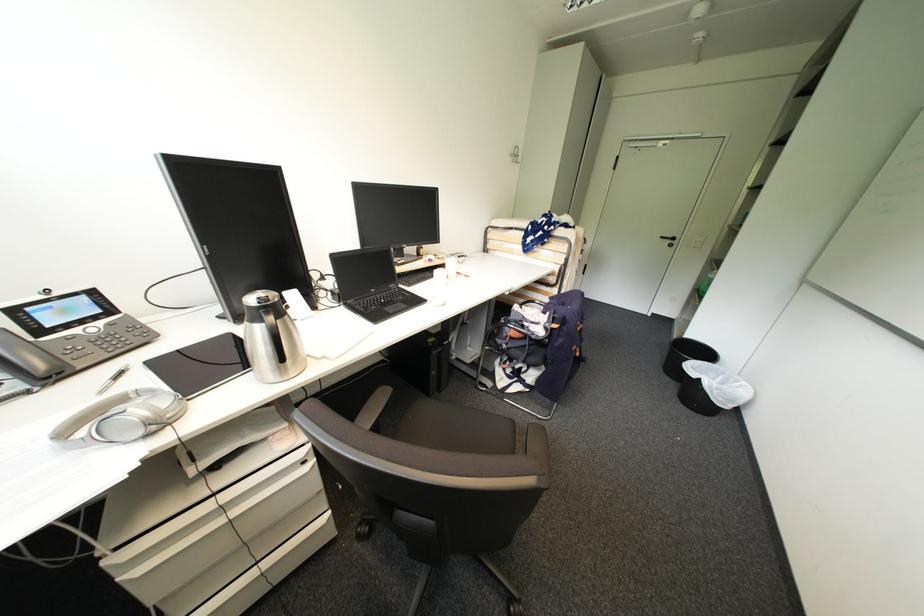
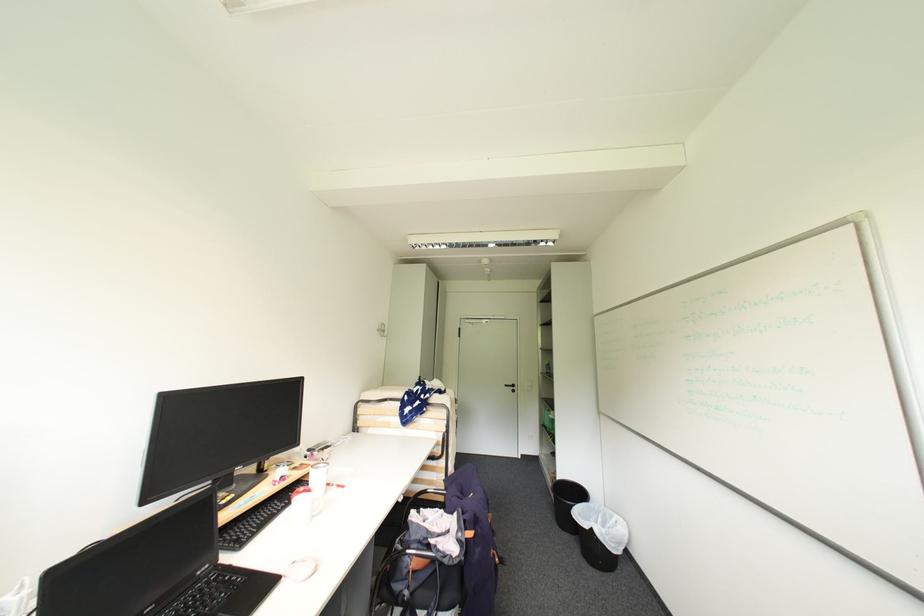
Locate, in the second image, the point that corresponds to point 517,156 in the first image.

(384, 331)